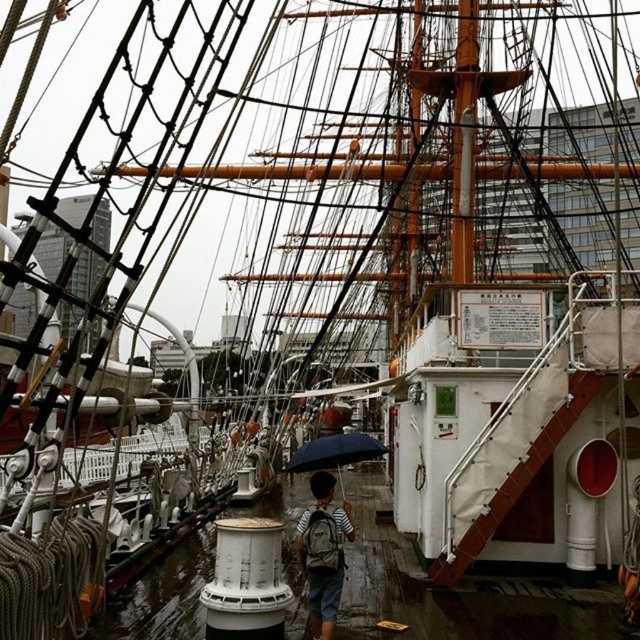
Question: Which of the following is the farthest from the observer?

Choices:
 (A) (330, 509)
 (B) (330, 465)

Answer: (B)

Question: Does striped fabric backpack at center appear on the left side of dark blue matte umbrella at center?

Choices:
 (A) no
 (B) yes

Answer: (A)

Question: Does striped fabric backpack at center appear under dark blue matte umbrella at center?

Choices:
 (A) no
 (B) yes

Answer: (A)

Question: Can you confirm if striped fabric backpack at center is positioned to the left of dark blue matte umbrella at center?

Choices:
 (A) no
 (B) yes

Answer: (A)